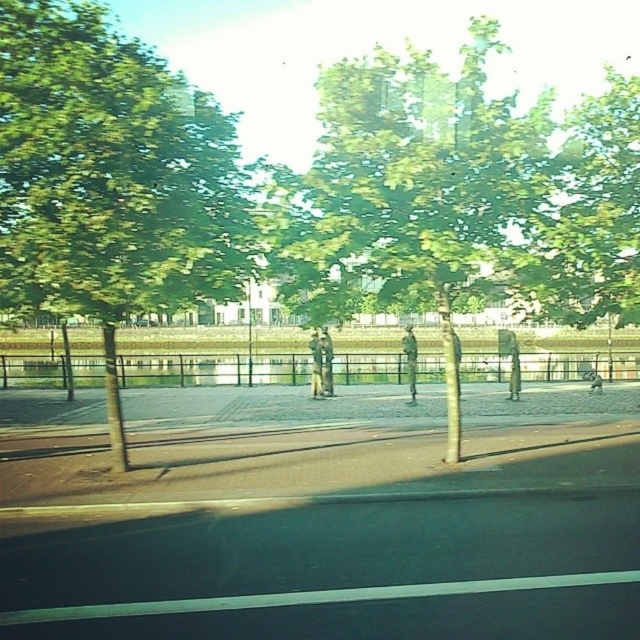
You are a GUI agent. You are given a task and a screenshot of the screen. Output one action in this format:
    pyautogui.click(x=<x>, y=<y>)
    Task: Click on the green leafy tree at upper left
    Image resolution: width=640 pixels, height=640 pixels.
    Given the screenshot: What is the action you would take?
    pyautogui.click(x=109, y=179)

Which is behind, point (29, 45) or point (314, 344)?

Point (314, 344)

Does point (17, 61) lie in front of point (321, 390)?

Yes, point (17, 61) is in front of point (321, 390).

This screenshot has width=640, height=640. I want to click on green leafy tree at upper left, so click(x=109, y=179).

Between green leafy tree at center and green metallic statue at center, which one has less height?

green metallic statue at center is shorter.

Is green leafy tree at center wider than green metallic statue at center?

Yes.

Who is more forward, (333, 131) or (330, 368)?

Point (333, 131) is more forward.

Locate an element on the screen. This screenshot has height=640, width=640. green leafy tree at center is located at coordinates (460, 196).

Which is above, metallic silver jacket at center or matte gray statue at center?

metallic silver jacket at center is higher up.

Is metallic silver jacket at center above matte gray statue at center?

Yes, metallic silver jacket at center is above matte gray statue at center.

Does point (413, 380) come closer to viewer compared to point (314, 387)?

Yes.

The height and width of the screenshot is (640, 640). What are the coordinates of `metallic silver jacket at center` in the screenshot? It's located at (410, 358).